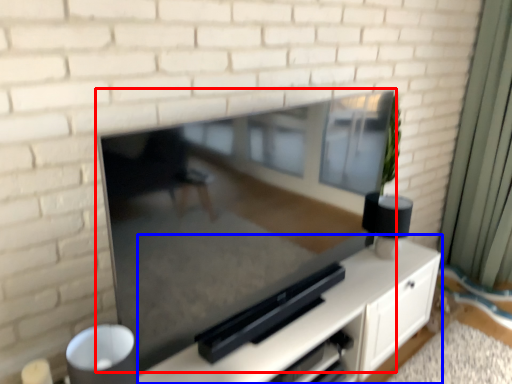
Question: Among these objects, which one is nearest to the camera, fireplace (highlighted by a red box) or entertainment center (highlighted by a blue box)?

Choices:
 (A) fireplace
 (B) entertainment center

Answer: (A)